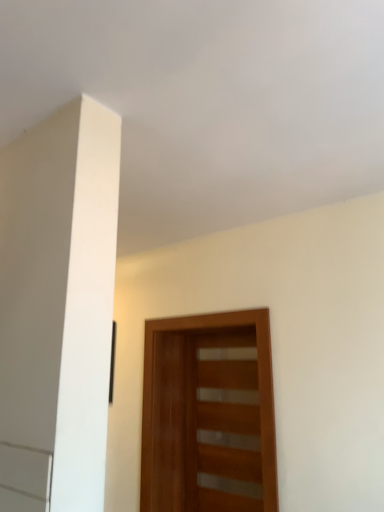
Describe the element at coordinates (207, 414) in the screenshot. This screenshot has width=384, height=512. I see `wooden door at center` at that location.

Identify the location of wooden door at center. The width and height of the screenshot is (384, 512). (207, 414).

This screenshot has width=384, height=512. In order to click on wooden door at center in this screenshot , I will do `click(207, 414)`.